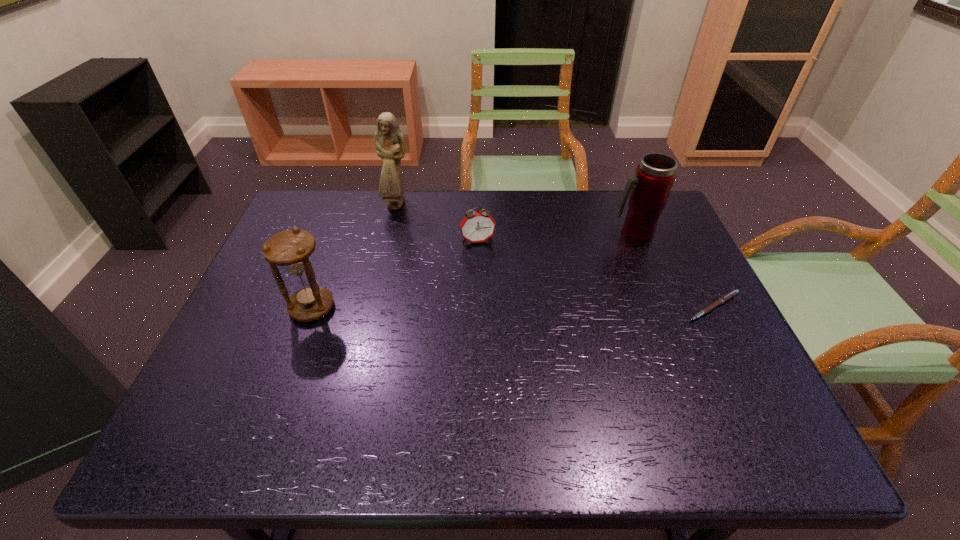
Identify the location of vacant space on the desktop that is between the hourglass and the shortest object and is positioned on the side with the handle of the thermos bottle. (568, 307).

Identify the location of free spot on the desktop that is between the leftmost object and the shortest object and is positioned on the clock face of the third object from left to right. (493, 307).

Find the location of `vacant space on the desktop that is between the hourglass and the pen and is positioned on the front-facing side of the farthest object`. vacant space on the desktop that is between the hourglass and the pen and is positioned on the front-facing side of the farthest object is located at coordinates [456, 307].